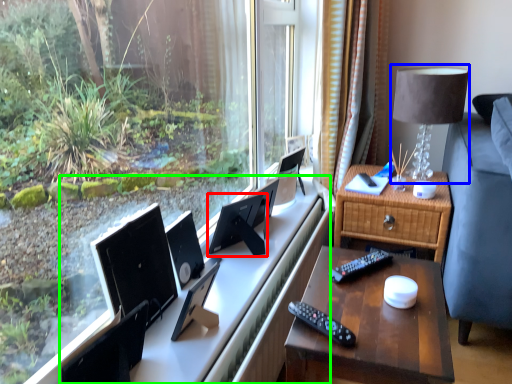
Question: Which is nearer to the computer monitor (highlighted by a red box)? table lamp (highlighted by a blue box) or computer desk (highlighted by a green box).

Choices:
 (A) table lamp
 (B) computer desk

Answer: (B)